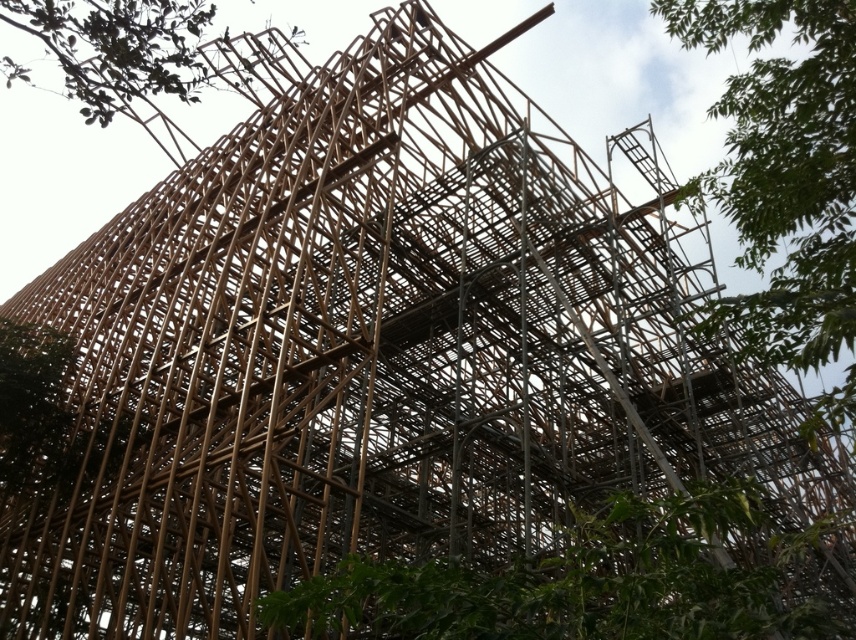
Question: Which point is farther to the camera?

Choices:
 (A) (373, 577)
 (B) (805, 257)
 (C) (177, 22)

Answer: (C)

Question: Is green leafy tree at lower center bigger than green leafy tree at upper left?

Choices:
 (A) yes
 (B) no

Answer: (B)

Question: From the image, what is the correct spatial relationship of green leafy tree at upper right in relation to green leafy tree at upper left?

Choices:
 (A) left
 (B) right

Answer: (B)

Question: Which object is positioned closest to the green leafy tree at upper left?

Choices:
 (A) green leafy tree at upper right
 (B) green leafy tree at lower center

Answer: (B)

Question: Does green leafy tree at lower center have a smaller size compared to green leafy tree at upper left?

Choices:
 (A) no
 (B) yes

Answer: (B)

Question: Which point is farther from the camera taking this photo?

Choices:
 (A) (817, 160)
 (B) (310, 604)
 (C) (119, 84)

Answer: (C)